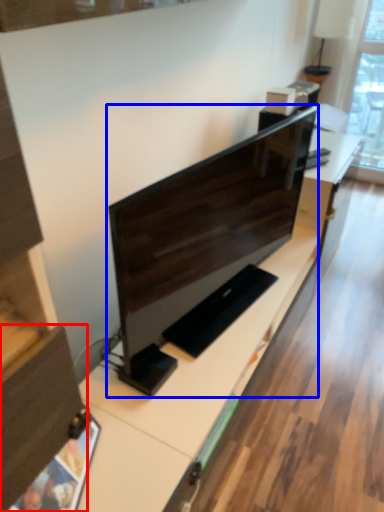
Question: Which object appears closest to the camera in this image, drawer (highlighted by a red box) or computer monitor (highlighted by a blue box)?

Choices:
 (A) drawer
 (B) computer monitor

Answer: (A)